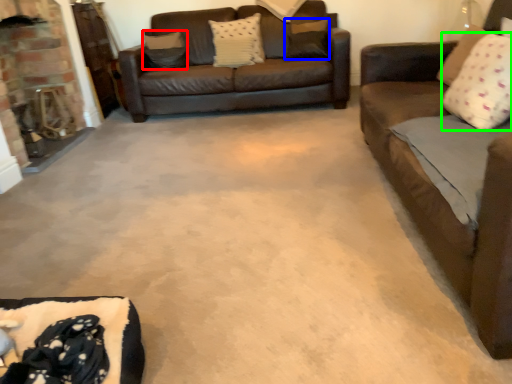
Question: Which is nearer to the pillow (highlighted by a red box)? pillow (highlighted by a blue box) or pillow (highlighted by a green box).

Choices:
 (A) pillow
 (B) pillow

Answer: (A)